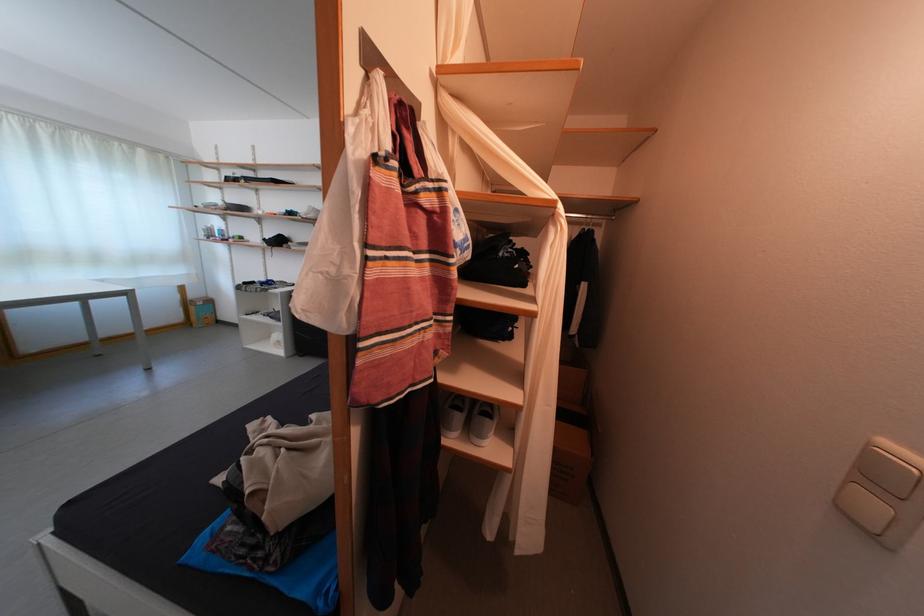
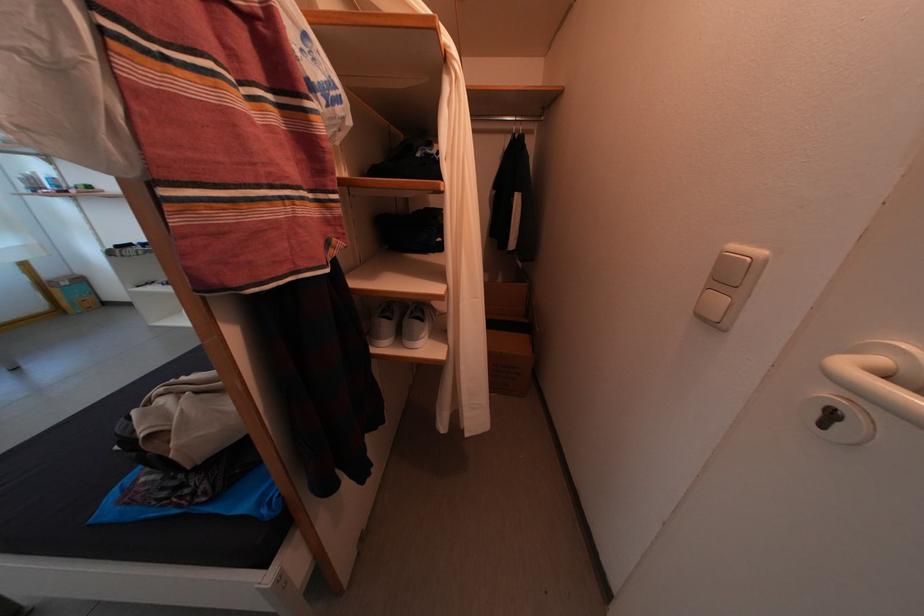
Locate, in the second image, the point that corresponds to (x=894, y=485) in the first image.

(739, 282)